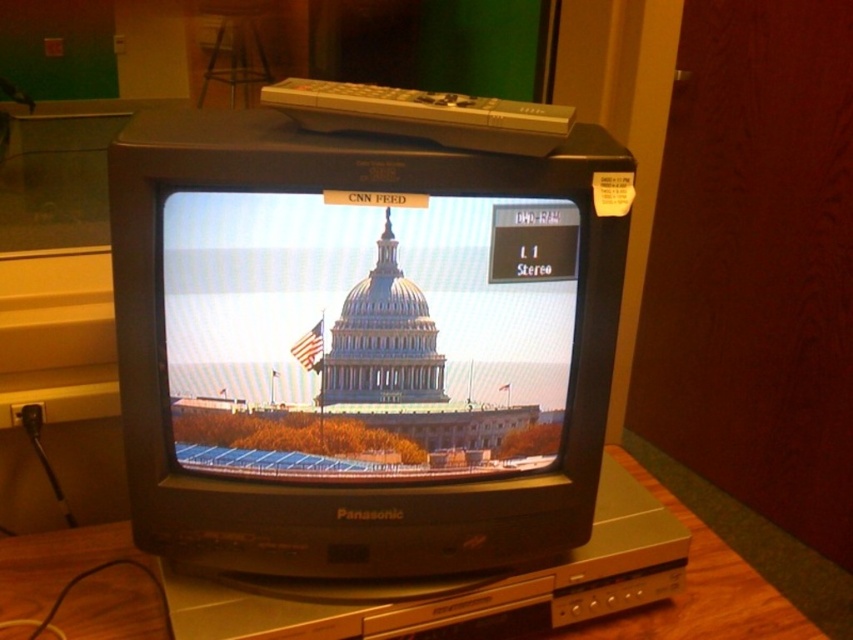
Who is more forward, (410,385) or (122,586)?

Point (410,385)

Who is shorter, matte glass dome at center or wooden table at center?

With less height is wooden table at center.

Which is behind, point (503, 412) or point (711, 627)?

Point (711, 627)

This screenshot has height=640, width=853. I want to click on matte glass dome at center, so click(368, 332).